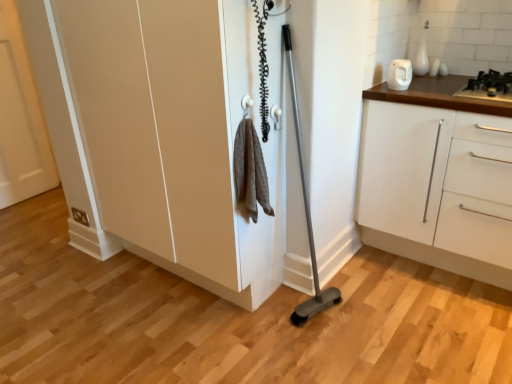
Question: Is white glossy kettle at upper right aimed at black metallic gas stove at upper right?

Choices:
 (A) no
 (B) yes

Answer: (A)

Question: Is white glossy kettle at upper right at the left side of black metallic gas stove at upper right?

Choices:
 (A) yes
 (B) no

Answer: (A)

Question: Is black metallic gas stove at upper right inside white glossy kettle at upper right?

Choices:
 (A) no
 (B) yes

Answer: (A)

Question: Does white glossy kettle at upper right have a greater width compared to black metallic gas stove at upper right?

Choices:
 (A) yes
 (B) no

Answer: (B)

Question: Considering the relative sizes of white glossy kettle at upper right and black metallic gas stove at upper right in the image provided, is white glossy kettle at upper right bigger than black metallic gas stove at upper right?

Choices:
 (A) yes
 (B) no

Answer: (B)

Question: Is white glossy kettle at upper right far away from black metallic gas stove at upper right?

Choices:
 (A) no
 (B) yes

Answer: (A)

Question: Could you tell me if matte white cupboard at center is facing white matte door at left?

Choices:
 (A) yes
 (B) no

Answer: (B)

Question: From the image's perspective, is matte white cupboard at center on top of white matte door at left?

Choices:
 (A) yes
 (B) no

Answer: (B)

Question: Can you confirm if matte white cupboard at center is taller than white matte door at left?

Choices:
 (A) no
 (B) yes

Answer: (A)

Question: Is matte white cupboard at center bigger than white matte door at left?

Choices:
 (A) no
 (B) yes

Answer: (B)

Question: Is matte white cupboard at center looking in the opposite direction of white matte door at left?

Choices:
 (A) no
 (B) yes

Answer: (A)

Question: From the image's perspective, is matte white cupboard at center beneath white matte door at left?

Choices:
 (A) yes
 (B) no

Answer: (A)

Question: From the image's perspective, is white glossy kettle at upper right above white matte cabinet at right?

Choices:
 (A) no
 (B) yes

Answer: (B)